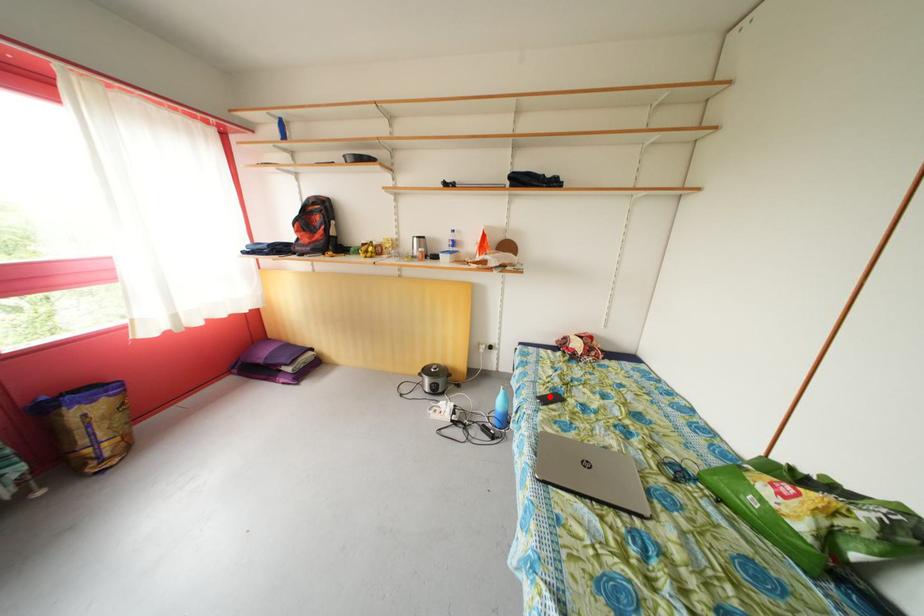
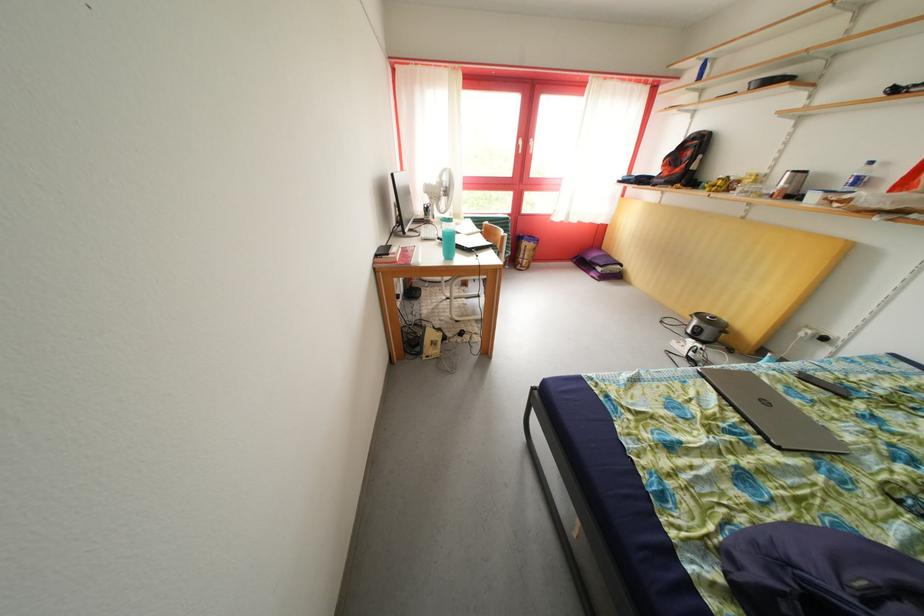
In the second image, find the point that corresponds to the highlighted location in the first image.

(831, 382)